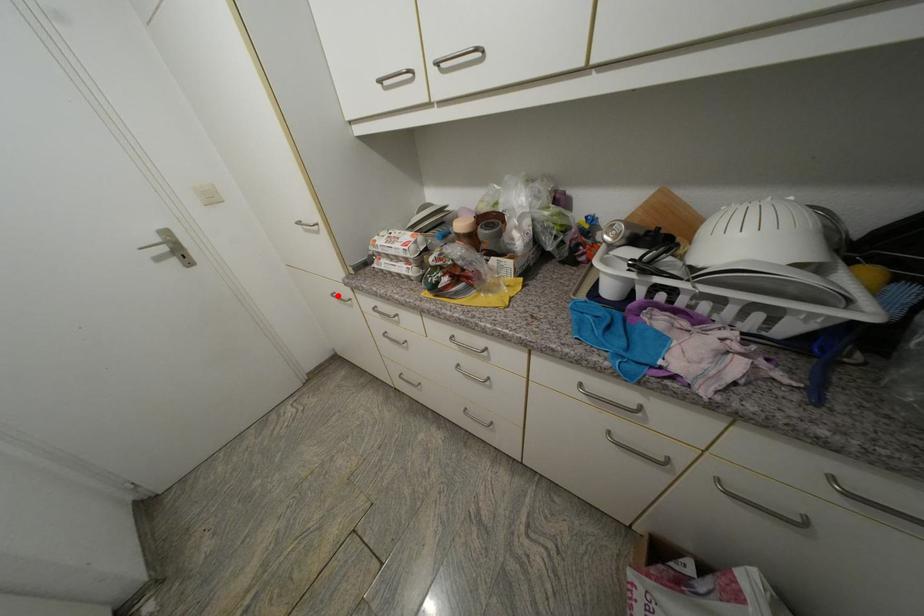
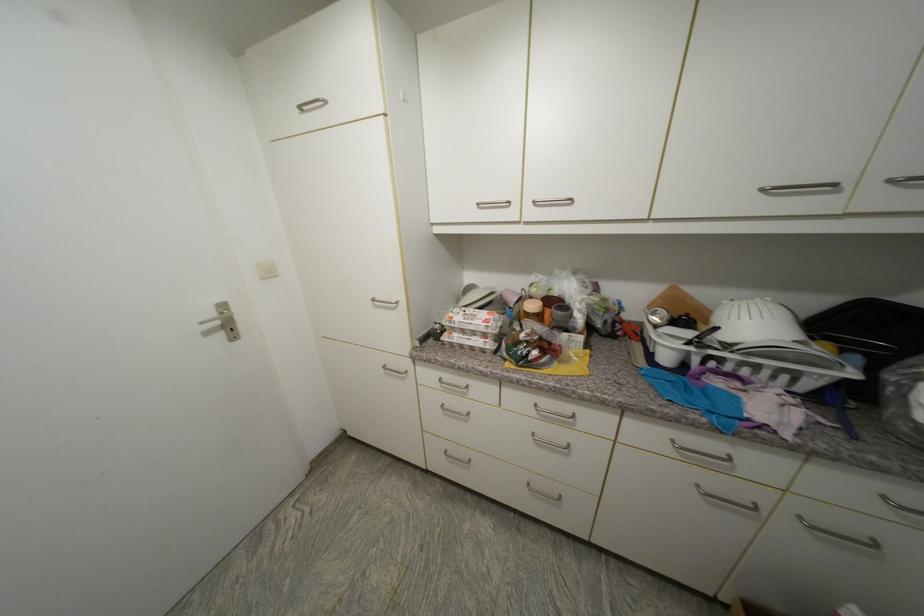
Find the pixel in the second image that matches the highlighted location in the first image.

(390, 369)